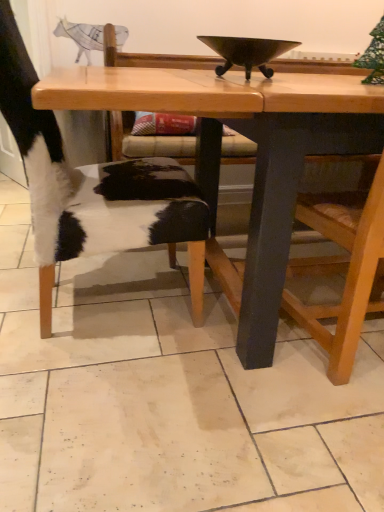
Question: From a real-world perspective, does shiny dark metal bowl at center stand above wooden table at center?

Choices:
 (A) yes
 (B) no

Answer: (A)

Question: Can we say shiny dark metal bowl at center lies outside wooden table at center?

Choices:
 (A) no
 (B) yes

Answer: (B)

Question: Is shiny dark metal bowl at center next to wooden table at center and touching it?

Choices:
 (A) no
 (B) yes

Answer: (A)

Question: From the image's perspective, is shiny dark metal bowl at center on wooden table at center?

Choices:
 (A) yes
 (B) no

Answer: (A)

Question: Does shiny dark metal bowl at center have a lesser height compared to wooden table at center?

Choices:
 (A) no
 (B) yes

Answer: (B)

Question: Does point (246, 267) appear closer or farther from the camera than point (205, 44)?

Choices:
 (A) farther
 (B) closer

Answer: (A)

Question: Considering the positions of wooden table at center and shiny dark metal bowl at center in the image, is wooden table at center wider or thinner than shiny dark metal bowl at center?

Choices:
 (A) wide
 (B) thin

Answer: (A)

Question: From the image's perspective, relative to shiny dark metal bowl at center, is wooden table at center above or below?

Choices:
 (A) below
 (B) above

Answer: (A)

Question: In the image, is wooden table at center positioned in front of or behind shiny dark metal bowl at center?

Choices:
 (A) front
 (B) behind

Answer: (A)

Question: Which is correct: wooden chair at right is inside shiny dark metal bowl at center, or outside of it?

Choices:
 (A) outside
 (B) inside

Answer: (A)

Question: Based on their sizes in the image, would you say wooden chair at right is bigger or smaller than shiny dark metal bowl at center?

Choices:
 (A) small
 (B) big

Answer: (B)

Question: Is wooden chair at right in front of or behind shiny dark metal bowl at center in the image?

Choices:
 (A) behind
 (B) front

Answer: (B)

Question: Is wooden chair at right wider or thinner than shiny dark metal bowl at center?

Choices:
 (A) wide
 (B) thin

Answer: (A)

Question: Is wooden chair at right in front of or behind wooden table at center in the image?

Choices:
 (A) front
 (B) behind

Answer: (A)

Question: From a real-world perspective, relative to wooden table at center, is wooden chair at right vertically above or below?

Choices:
 (A) below
 (B) above

Answer: (B)